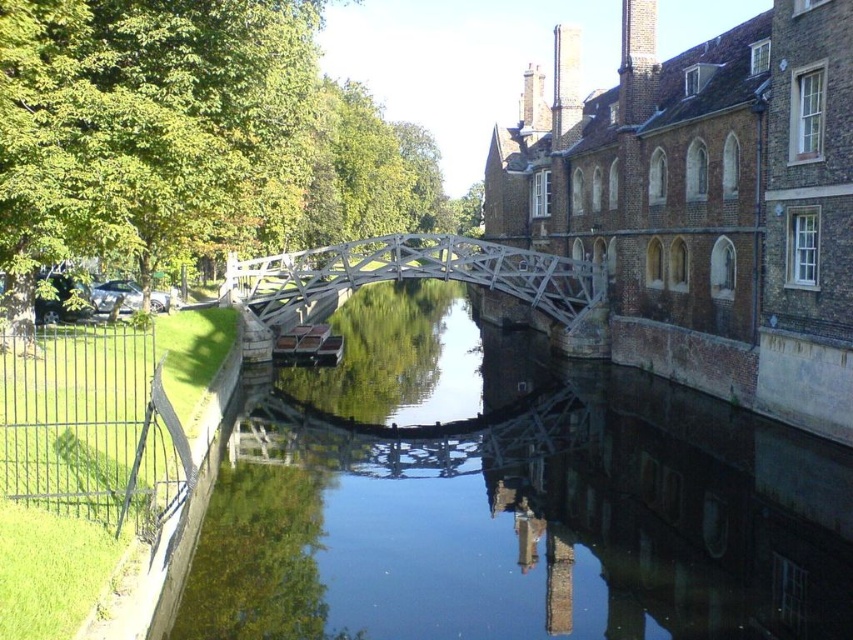
Is clear water at center thinner than white wooden bridge at center?

In fact, clear water at center might be wider than white wooden bridge at center.

Identify the location of clear water at center. (515, 502).